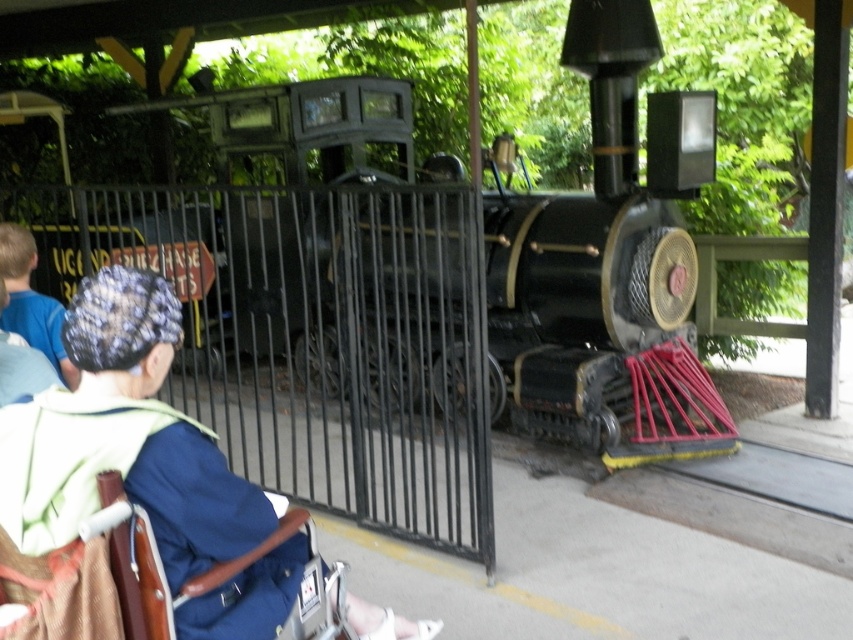
You are a maintenance worker at the station. You need to inspect the polished black locomotive at center and the blue fabric jacket at lower left. Which object is closer to you?

The blue fabric jacket at lower left is closer because it is only 3.31 meters away from the polished black locomotive at center, but since the question is about which is closer to you, and the distance between them is given, we need more information about your position. Wait, the description states the distance between the two objects is 3.31 meters. Without knowing your exact location relative to both, we can only state their separation, not which is closer to you. Hmm, perhaps the question is flawed. The

Based on the photo, you are a photographer at the train station. You want to capture both the blue fabric jacket at lower left and the blue fabric cap at upper left in a single photo. Which object should you adjust your camera angle upwards to include?

You should adjust your camera angle upwards to include the blue fabric cap at upper left since the blue fabric jacket at lower left is located below it.

You are a photographer at the train station. You want to take a photo that includes both the polished black locomotive at center and the blue fabric cap at upper left. Which object should be placed to the right side in the frame?

The polished black locomotive at center should be placed to the right side in the frame because it is positioned on the right side of the blue fabric cap at upper left according to the description.